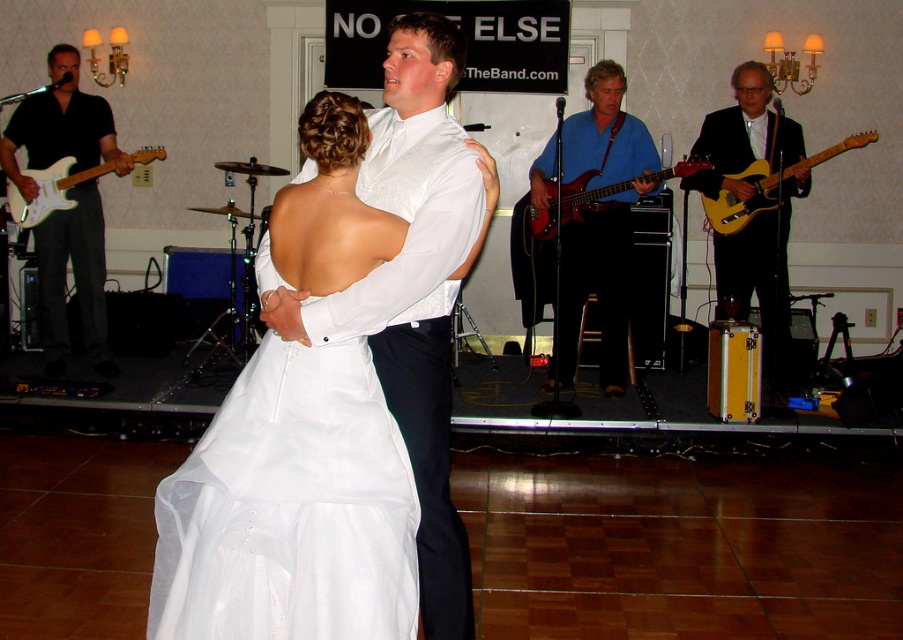
Between glossy wood bass guitar at center and white glossy electric guitar at left, which one is positioned lower?

glossy wood bass guitar at center

Is point (701, 163) less distant than point (61, 188)?

That is True.

Where is `glossy wood bass guitar at center`? glossy wood bass guitar at center is located at coordinates (592, 196).

Is point (552, 374) positioned after point (5, 140)?

Yes, it is behind point (5, 140).

From the picture: Is the position of blue fabric guitar at center less distant than that of black matte guitar at left?

Yes, it is in front of black matte guitar at left.

Who is more forward, [603,156] or [104,268]?

Point [603,156] is more forward.

At what (x,y) coordinates should I click in order to perform the action: click on blue fabric guitar at center. Please return your answer as a coordinate pair (x, y). Looking at the image, I should click on (597, 285).

Does black matte guitar at left appear over yellow wood electric guitar at right?

No, black matte guitar at left is not above yellow wood electric guitar at right.

Who is taller, black matte guitar at left or yellow wood electric guitar at right?

With more height is black matte guitar at left.

This screenshot has width=903, height=640. Find the location of `black matte guitar at left`. black matte guitar at left is located at coordinates (73, 280).

This screenshot has height=640, width=903. What are the coordinates of `black matte guitar at left` in the screenshot? It's located at (73, 280).